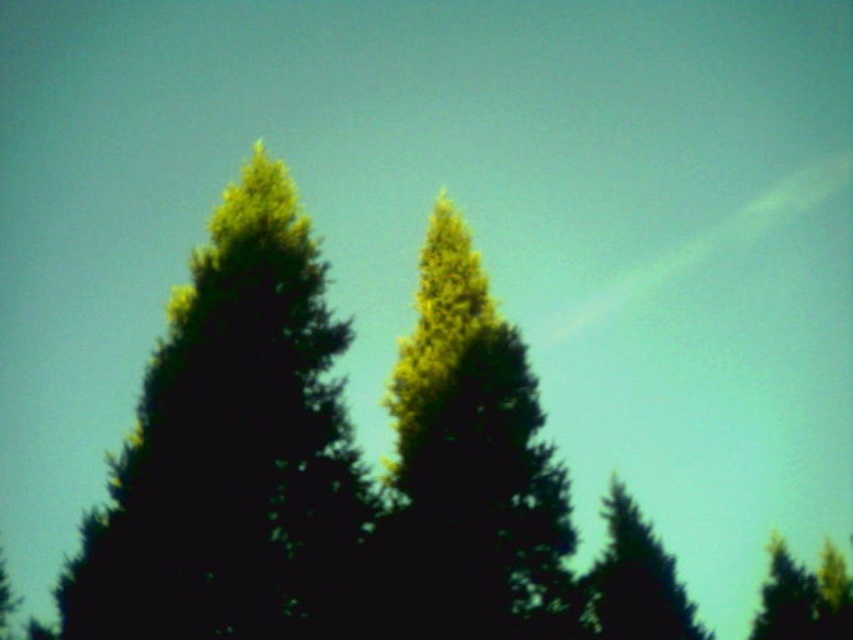
In the scene shown: Can you confirm if green matte fir tree at left is positioned above green matte tree at lower right?

Correct, green matte fir tree at left is located above green matte tree at lower right.

Between green matte fir tree at left and green matte tree at lower right, which one is positioned lower?

Positioned lower is green matte tree at lower right.

This screenshot has width=853, height=640. I want to click on green matte fir tree at left, so click(231, 449).

Does green textured tree at lower right lie behind green matte tree at lower right?

No, it is not.

Is point (682, 620) positioned in front of point (757, 621)?

Yes, point (682, 620) is in front of point (757, 621).

Find the location of a particular element. green textured tree at lower right is located at coordinates (636, 579).

Is point (453, 387) positioned behind point (781, 570)?

No.

This screenshot has width=853, height=640. Describe the element at coordinates (471, 467) in the screenshot. I see `green matte fir tree at center` at that location.

The image size is (853, 640). I want to click on green matte fir tree at center, so click(471, 467).